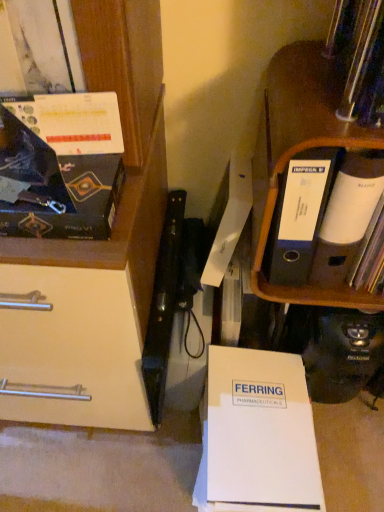
Question: Is white paper at lower center not close to matte black magazine at upper left?

Choices:
 (A) no
 (B) yes

Answer: (A)

Question: Considering the relative sizes of white paper at lower center and matte black magazine at upper left in the image provided, is white paper at lower center shorter than matte black magazine at upper left?

Choices:
 (A) yes
 (B) no

Answer: (B)

Question: Is white paper at lower center facing towards matte black magazine at upper left?

Choices:
 (A) no
 (B) yes

Answer: (A)

Question: Can we say white paper at lower center lies outside matte black magazine at upper left?

Choices:
 (A) no
 (B) yes

Answer: (B)

Question: Would you say matte black magazine at upper left is part of white paper at lower center's contents?

Choices:
 (A) yes
 (B) no

Answer: (B)

Question: Does point (309, 480) appear closer or farther from the camera than point (337, 65)?

Choices:
 (A) farther
 (B) closer

Answer: (A)

Question: Which is correct: white paper at lower center is inside black cardboard file at upper right, or outside of it?

Choices:
 (A) outside
 (B) inside

Answer: (A)

Question: From the image's perspective, relative to black cardboard file at upper right, is white paper at lower center above or below?

Choices:
 (A) above
 (B) below

Answer: (B)

Question: Looking at the image, does white paper at lower center seem bigger or smaller compared to black cardboard file at upper right?

Choices:
 (A) big
 (B) small

Answer: (A)

Question: Is matte black magazine at upper left in front of or behind black cardboard file at upper right in the image?

Choices:
 (A) front
 (B) behind

Answer: (A)

Question: From a real-world perspective, is matte black magazine at upper left above or below black cardboard file at upper right?

Choices:
 (A) below
 (B) above

Answer: (B)

Question: Is matte black magazine at upper left spatially inside black cardboard file at upper right, or outside of it?

Choices:
 (A) inside
 (B) outside

Answer: (B)

Question: Looking at the image, does matte black magazine at upper left seem bigger or smaller compared to black cardboard file at upper right?

Choices:
 (A) big
 (B) small

Answer: (B)

Question: Is black cardboard file at upper right situated inside matte black magazine at upper left or outside?

Choices:
 (A) inside
 (B) outside

Answer: (B)

Question: Considering their positions, is black cardboard file at upper right located in front of or behind matte black magazine at upper left?

Choices:
 (A) behind
 (B) front

Answer: (A)